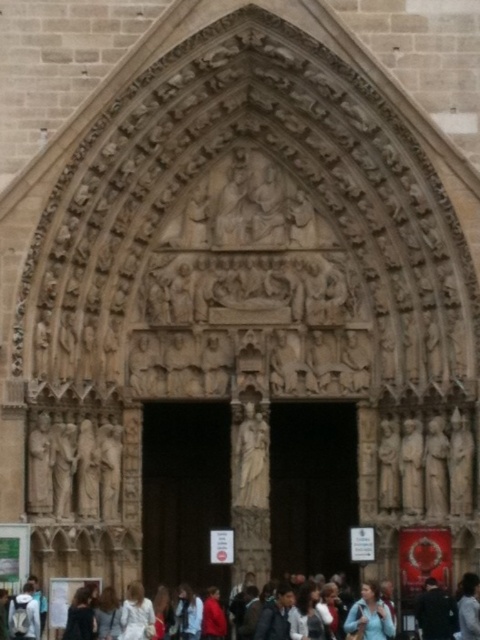
Does light blue fabric at center appear on the left side of dark gray fabric jacket at lower center?

Yes, light blue fabric at center is to the left of dark gray fabric jacket at lower center.

Who is shorter, light blue fabric at center or dark gray fabric jacket at lower center?

Standing shorter between the two is dark gray fabric jacket at lower center.

Is point (389, 636) less distant than point (444, 621)?

Yes, it is in front of point (444, 621).

Where is `light blue fabric at center`? The image size is (480, 640). light blue fabric at center is located at coordinates (369, 616).

Does point (32, 596) come behind point (441, 634)?

No.

Does multicolored fabric crowd at lower center lie in front of dark gray fabric jacket at lower center?

Yes, multicolored fabric crowd at lower center is in front of dark gray fabric jacket at lower center.

This screenshot has height=640, width=480. I want to click on multicolored fabric crowd at lower center, so click(436, 611).

Which of these two, brown wooden door at center or dark gray fabric jacket at lower center, stands taller?

brown wooden door at center is taller.

Can you confirm if brown wooden door at center is positioned to the right of dark gray fabric jacket at lower center?

In fact, brown wooden door at center is to the left of dark gray fabric jacket at lower center.

The width and height of the screenshot is (480, 640). Describe the element at coordinates (183, 492) in the screenshot. I see `brown wooden door at center` at that location.

At what (x,y) coordinates should I click in order to perform the action: click on brown wooden door at center. Please return your answer as a coordinate pair (x, y). Looking at the image, I should click on (183, 492).